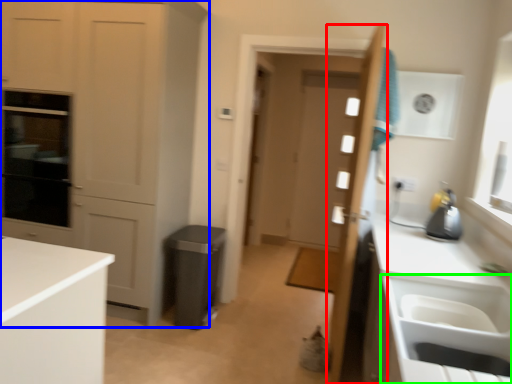
Question: Which object is positioned closest to door (highlighted by a red box)? Select from cabinetry (highlighted by a blue box) and sink (highlighted by a green box).

Choices:
 (A) cabinetry
 (B) sink

Answer: (B)